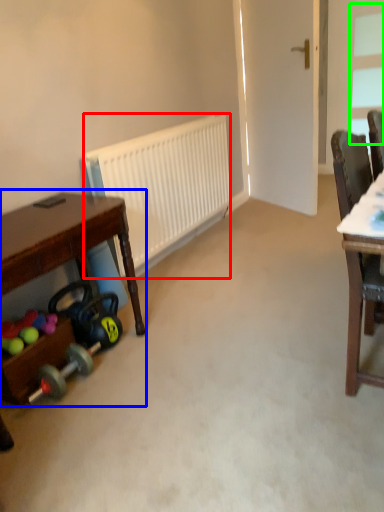
Question: Considering the real-world distances, which object is farthest from radiator (highlighted by a red box)? desk (highlighted by a blue box) or window (highlighted by a green box)?

Choices:
 (A) desk
 (B) window

Answer: (B)